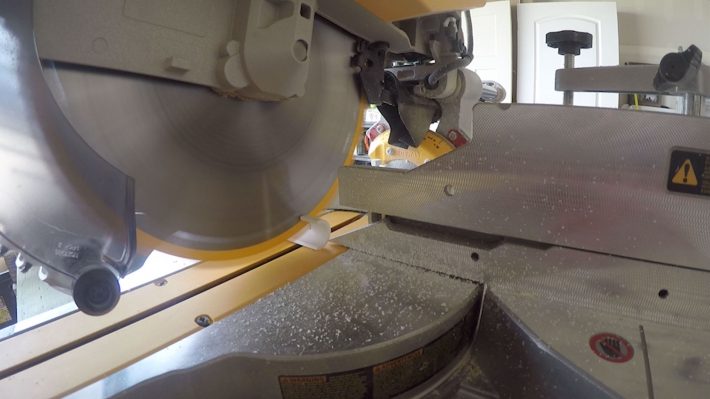
The height and width of the screenshot is (399, 710). What are the coordinates of `picture frame` in the screenshot? It's located at (654, 98).